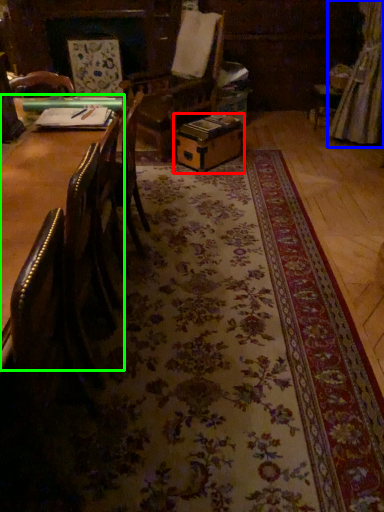
Question: Which is farther away from cardboard box (highlighted by a red box)? curtain (highlighted by a blue box) or table (highlighted by a green box)?

Choices:
 (A) curtain
 (B) table

Answer: (B)